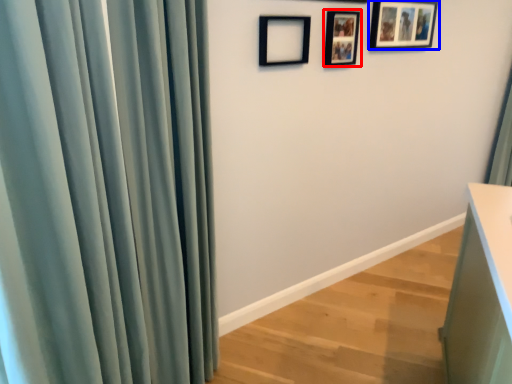
Question: Among these objects, which one is farthest to the camera, picture frame (highlighted by a red box) or picture frame (highlighted by a blue box)?

Choices:
 (A) picture frame
 (B) picture frame

Answer: (B)